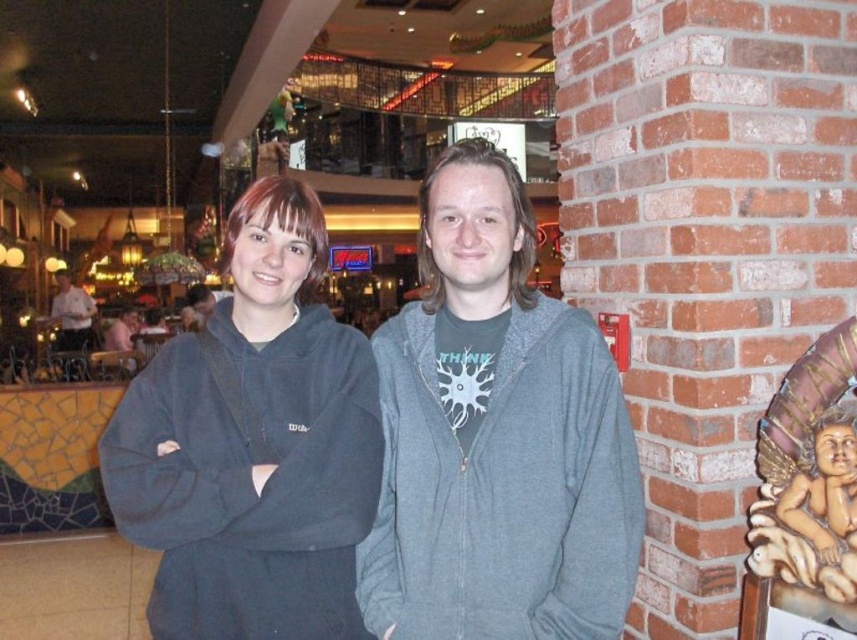
Question: Is gray fleece sweatshirt at center behind white shirt at left?

Choices:
 (A) yes
 (B) no

Answer: (B)

Question: Which is farther from the dark gray fleece at center?

Choices:
 (A) dark gray sweatshirt at center
 (B) gray fleece sweatshirt at center
 (C) white shirt at left

Answer: (C)

Question: Which object is closer to the camera taking this photo?

Choices:
 (A) white shirt at left
 (B) gray fleece sweatshirt at center
 (C) dark gray fleece at center

Answer: (B)

Question: Does dark gray sweatshirt at center have a larger size compared to white shirt at left?

Choices:
 (A) no
 (B) yes

Answer: (B)

Question: Can you confirm if dark gray fleece at center is positioned below white shirt at left?

Choices:
 (A) yes
 (B) no

Answer: (A)

Question: Among these points, which one is farthest from the camera?

Choices:
 (A) (69, 339)
 (B) (345, 413)
 (C) (438, 308)

Answer: (A)